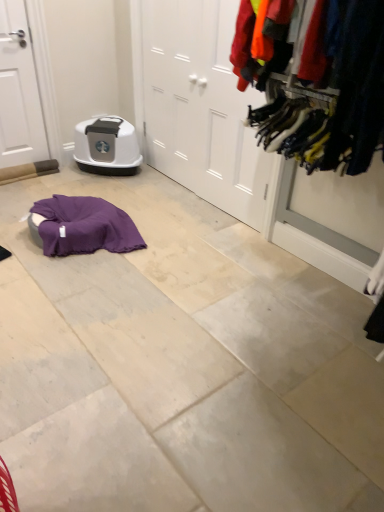
Question: In the image, is textured fabric clothes at right on the left side or the right side of matte gray plastic litter box at center?

Choices:
 (A) right
 (B) left

Answer: (A)

Question: Is point (273, 27) closer or farther from the camera than point (107, 145)?

Choices:
 (A) farther
 (B) closer

Answer: (B)

Question: Which is farther from the white matte door at left, positioned as the second door in right-to-left order?

Choices:
 (A) textured fabric clothes at right
 (B) white matte door at center, positioned as the second door in left-to-right order
 (C) matte gray plastic litter box at center

Answer: (A)

Question: Which is farther from the white matte door at left, positioned as the second door in right-to-left order?

Choices:
 (A) white matte door at center, positioned as the second door in left-to-right order
 (B) textured fabric clothes at right
 (C) matte gray plastic litter box at center

Answer: (B)